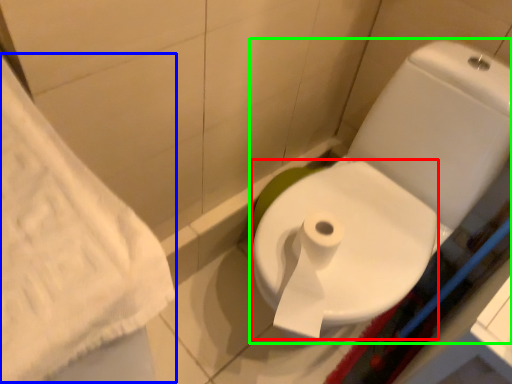
Question: Based on their relative distances, which object is nearer to bidet (highlighted by a red box)? Choose from bath towel (highlighted by a blue box) and toilet (highlighted by a green box).

Choices:
 (A) bath towel
 (B) toilet

Answer: (B)